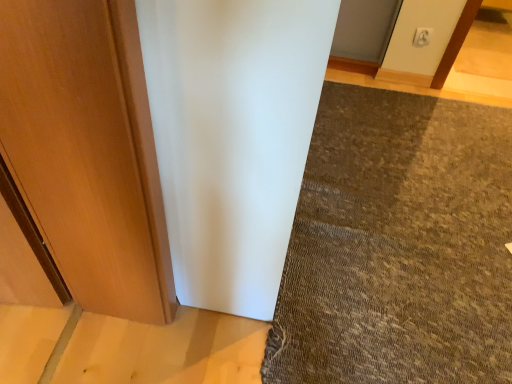
Question: Considering the relative positions of brown textured mat at lower right and white plastic electric outlet at upper center in the image provided, is brown textured mat at lower right to the left or to the right of white plastic electric outlet at upper center?

Choices:
 (A) left
 (B) right

Answer: (A)

Question: Which is correct: brown textured mat at lower right is inside white plastic electric outlet at upper center, or outside of it?

Choices:
 (A) outside
 (B) inside

Answer: (A)

Question: In terms of width, does brown textured mat at lower right look wider or thinner when compared to white plastic electric outlet at upper center?

Choices:
 (A) thin
 (B) wide

Answer: (B)

Question: In terms of width, does white plastic electric outlet at upper center look wider or thinner when compared to brown textured mat at lower right?

Choices:
 (A) wide
 (B) thin

Answer: (B)

Question: Is white plastic electric outlet at upper center to the left or to the right of brown textured mat at lower right in the image?

Choices:
 (A) right
 (B) left

Answer: (A)

Question: From a real-world perspective, is white plastic electric outlet at upper center above or below brown textured mat at lower right?

Choices:
 (A) above
 (B) below

Answer: (A)

Question: Considering their positions, is white plastic electric outlet at upper center located in front of or behind brown textured mat at lower right?

Choices:
 (A) behind
 (B) front

Answer: (A)